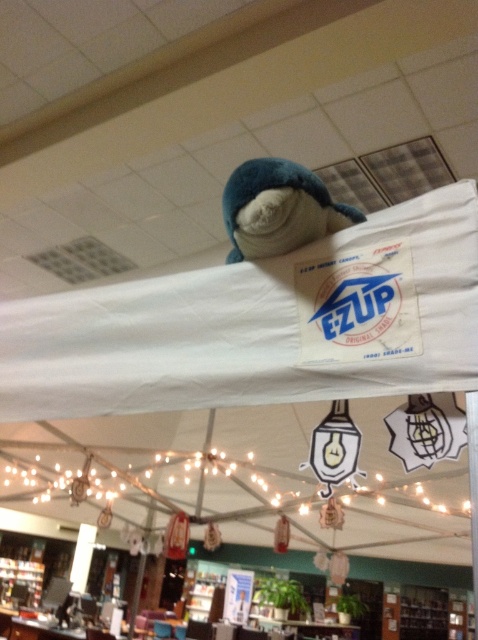
You are standing inside the tent and want to hang a new decoration. The white fabric canopy at upper center is located at coordinates 0.508, 0.548. Can you confirm if this is the central point of the tent?

The white fabric canopy at upper center is positioned at point (261, 324), which typically indicates it is centrally located in the tent.

Consider the image. You are a customer standing inside the tent and want to know if the white fabric canopy at upper center can fully cover the soft blue plush at upper center. Based on their sizes, can it?

The white fabric canopy at upper center is wider than the soft blue plush at upper center, so it can fully cover it.